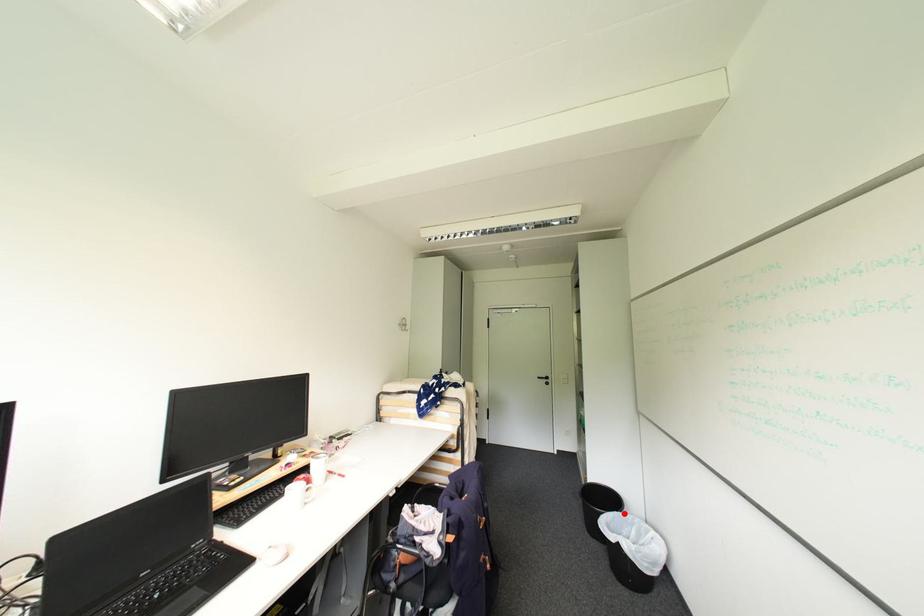
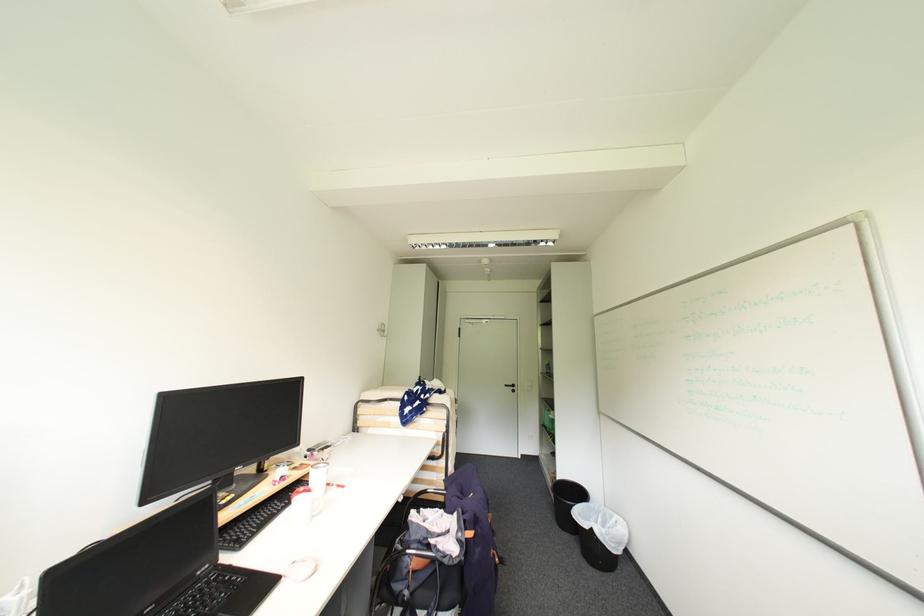
The point at the highlighted location is marked in the first image. Where is the corresponding point in the second image?

(591, 505)